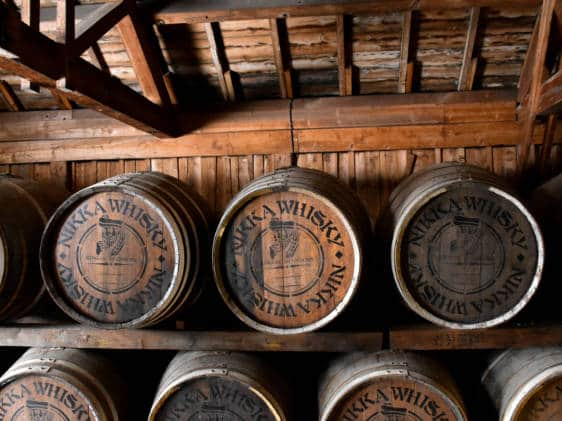
The height and width of the screenshot is (421, 562). What are the coordinates of `bumps on edge of shelf` in the screenshot? It's located at (81, 333), (62, 333), (139, 341), (192, 341), (306, 344).